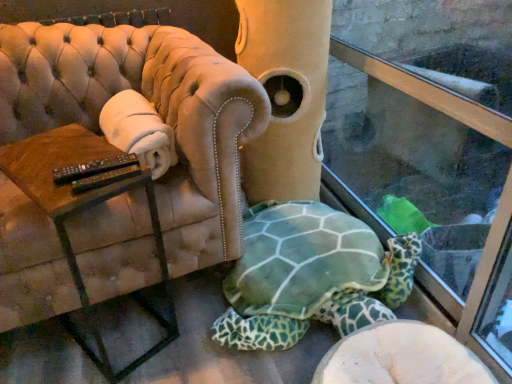
Question: From the image's perspective, is brown wooden table at left above velvet beige armchair at center?

Choices:
 (A) yes
 (B) no

Answer: (B)

Question: Considering the relative sizes of brown wooden table at left and velvet beige armchair at center in the image provided, is brown wooden table at left wider than velvet beige armchair at center?

Choices:
 (A) no
 (B) yes

Answer: (A)

Question: From a real-world perspective, is brown wooden table at left under velvet beige armchair at center?

Choices:
 (A) yes
 (B) no

Answer: (A)

Question: Can you confirm if brown wooden table at left is taller than velvet beige armchair at center?

Choices:
 (A) yes
 (B) no

Answer: (B)

Question: Can you confirm if brown wooden table at left is positioned to the right of velvet beige armchair at center?

Choices:
 (A) yes
 (B) no

Answer: (A)

Question: Is brown wooden table at left smaller than velvet beige armchair at center?

Choices:
 (A) yes
 (B) no

Answer: (A)

Question: Can you confirm if transparent glass shop window at lower right is taller than brown wooden table at left?

Choices:
 (A) no
 (B) yes

Answer: (B)

Question: Is brown wooden table at left completely or partially inside transparent glass shop window at lower right?

Choices:
 (A) no
 (B) yes

Answer: (A)

Question: From a real-world perspective, does transparent glass shop window at lower right sit lower than brown wooden table at left?

Choices:
 (A) no
 (B) yes

Answer: (A)

Question: Is transparent glass shop window at lower right thinner than brown wooden table at left?

Choices:
 (A) yes
 (B) no

Answer: (A)

Question: From the image's perspective, is transparent glass shop window at lower right under brown wooden table at left?

Choices:
 (A) yes
 (B) no

Answer: (B)

Question: From a real-world perspective, is transparent glass shop window at lower right over brown wooden table at left?

Choices:
 (A) no
 (B) yes

Answer: (B)

Question: Is the position of velvet beige armchair at center more distant than that of transparent glass shop window at lower right?

Choices:
 (A) yes
 (B) no

Answer: (A)